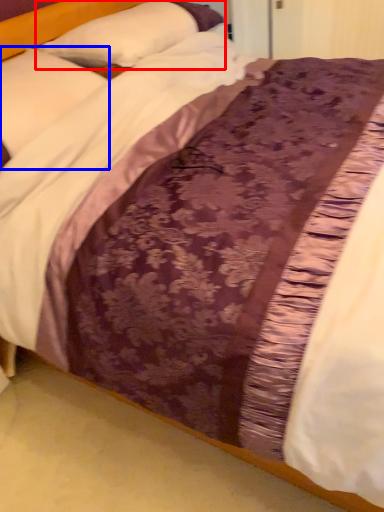
Question: Which of the following is the farthest to the observer, pillow (highlighted by a red box) or pillow (highlighted by a blue box)?

Choices:
 (A) pillow
 (B) pillow

Answer: (A)